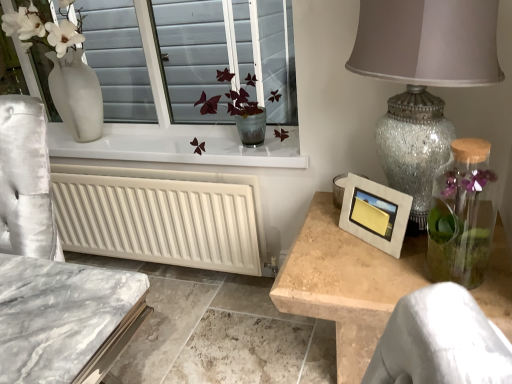
Question: Does translucent glass vase at center have a lesser height compared to matte silver picture frame at right?

Choices:
 (A) no
 (B) yes

Answer: (A)

Question: Considering the relative sizes of translucent glass vase at center and matte silver picture frame at right in the image provided, is translucent glass vase at center taller than matte silver picture frame at right?

Choices:
 (A) yes
 (B) no

Answer: (A)

Question: Is translucent glass vase at center facing towards matte silver picture frame at right?

Choices:
 (A) yes
 (B) no

Answer: (B)

Question: Is translucent glass vase at center next to matte silver picture frame at right and touching it?

Choices:
 (A) no
 (B) yes

Answer: (A)

Question: From a real-world perspective, is translucent glass vase at center physically below matte silver picture frame at right?

Choices:
 (A) no
 (B) yes

Answer: (A)

Question: Can you confirm if translucent glass vase at center is wider than matte silver picture frame at right?

Choices:
 (A) no
 (B) yes

Answer: (B)

Question: Is clear glass vase at right to the left of crackle glass lampshade at right from the viewer's perspective?

Choices:
 (A) yes
 (B) no

Answer: (B)

Question: Are clear glass vase at right and crackle glass lampshade at right far apart?

Choices:
 (A) yes
 (B) no

Answer: (B)

Question: Is clear glass vase at right positioned behind crackle glass lampshade at right?

Choices:
 (A) no
 (B) yes

Answer: (B)

Question: Is clear glass vase at right smaller than crackle glass lampshade at right?

Choices:
 (A) yes
 (B) no

Answer: (A)

Question: Does clear glass vase at right have a lesser height compared to crackle glass lampshade at right?

Choices:
 (A) no
 (B) yes

Answer: (B)

Question: From a real-world perspective, does clear glass vase at right stand above crackle glass lampshade at right?

Choices:
 (A) yes
 (B) no

Answer: (B)

Question: Is clear glass vase at right surrounding translucent glass vase at center?

Choices:
 (A) yes
 (B) no

Answer: (B)